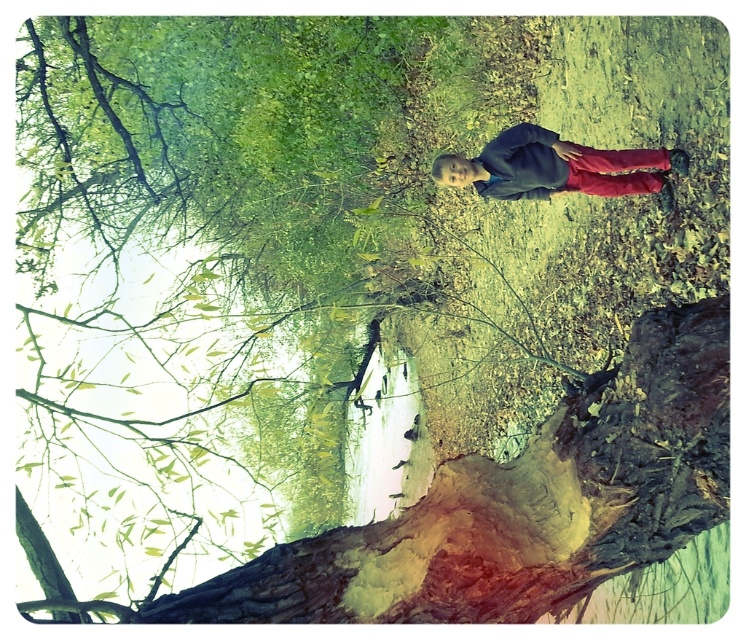
You are standing at the point labeled as point (589, 156) in the rotated image. If you want to walk towards the person on the right side of the image, which direction should you move relative to the point labeled as point (495, 596)?

You should move towards the point labeled as point (495, 596) because it is in front of point (589, 156), indicating the direction towards the person on the right side of the image.

You are a photographer trying to frame a shot of the smooth bark tree trunk at lower center and the matte blue jacket at center. Which object should you adjust your camera to focus on first if you want to capture both in a single frame, considering their sizes?

The smooth bark tree trunk at lower center has a larger width than the matte blue jacket at center, so you should focus on the smooth bark tree trunk at lower center first to ensure it fits properly in the frame.

You are a photographer trying to capture a photo of the smooth bark tree trunk at lower center and the matte blue jacket at center. Based on the scene, which object is positioned closer to the bottom of the image?

The smooth bark tree trunk at lower center is positioned closer to the bottom of the image because it is below the matte blue jacket at center.